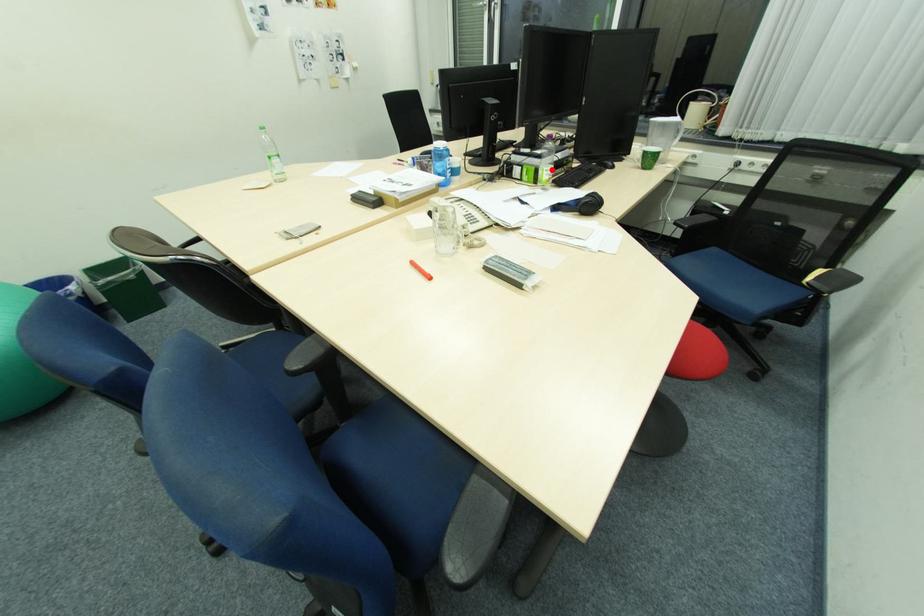
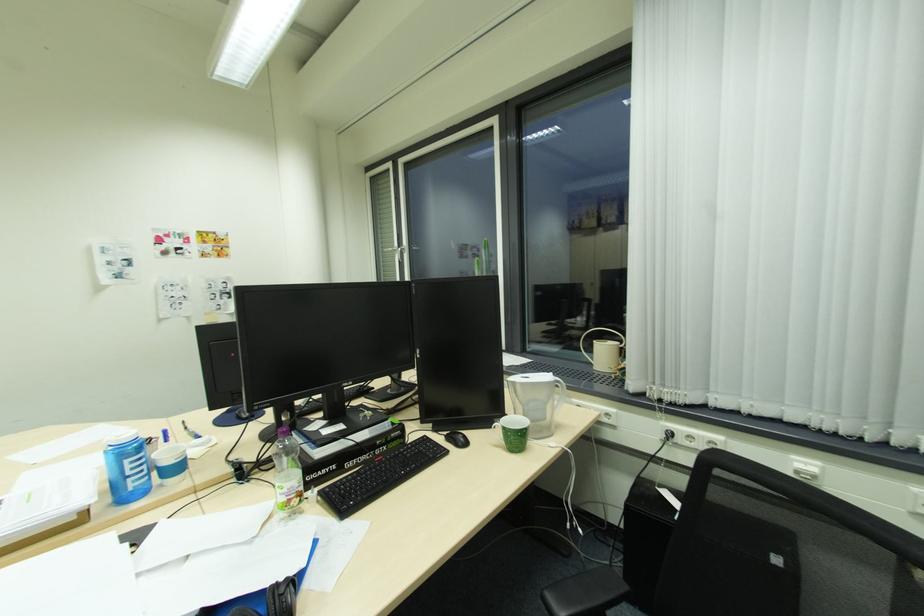
Question: I am providing you with two images of the same scene from different viewpoints. A red point is shown in image1. For the corresponding object point in image2, is it positioned nearer or farther from the camera?

Choices:
 (A) Nearer
 (B) Farther

Answer: (B)